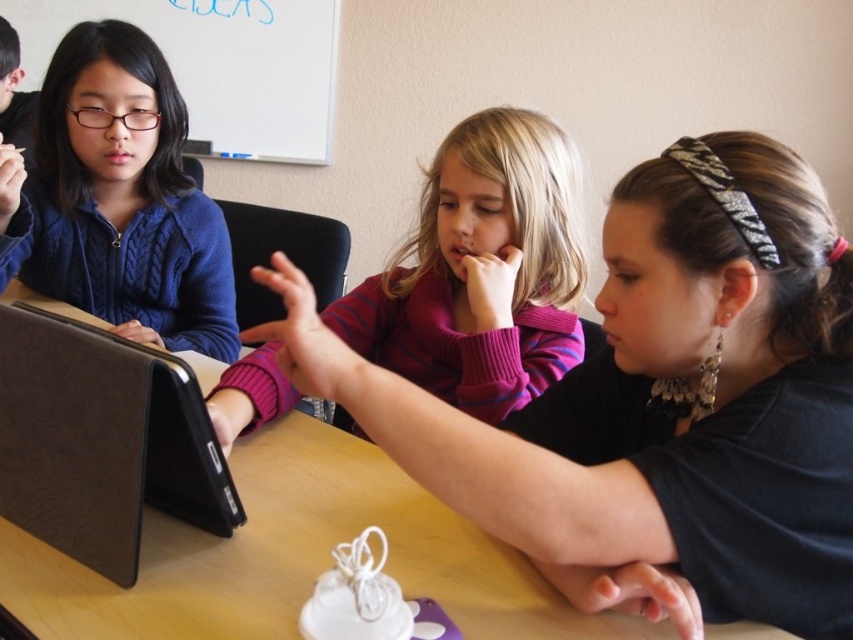
Is cable-knit sweater at upper left to the left of black leather laptop at left from the viewer's perspective?

Yes, cable-knit sweater at upper left is to the left of black leather laptop at left.

Who is more distant from viewer, (77, 269) or (184, 506)?

The point (77, 269) is behind.

Between point (143, 276) and point (67, 348), which one is positioned in front?

Point (67, 348) is more forward.

You are a GUI agent. You are given a task and a screenshot of the screen. Output one action in this format:
    pyautogui.click(x=<x>, y=<y>)
    Task: Click on the cable-knit sweater at upper left
    
    Given the screenshot: What is the action you would take?
    pyautogui.click(x=120, y=198)

Which of these two, black matte shirt at center or cable-knit sweater at upper left, stands taller?

cable-knit sweater at upper left is taller.

Is point (619, 182) farther from viewer compared to point (142, 196)?

No, (619, 182) is closer to viewer.

Which is behind, point (845, 621) or point (178, 348)?

Point (178, 348)

At what (x,y) coordinates should I click in order to perform the action: click on black matte shirt at center. Please return your answer as a coordinate pair (x, y). The height and width of the screenshot is (640, 853). Looking at the image, I should click on (659, 401).

Is point (758, 186) less distant than point (126, 394)?

No, it is behind (126, 394).

Between black matte shirt at center and black leather laptop at left, which one is positioned higher?

black matte shirt at center is higher up.

Which is behind, point (618, 273) or point (42, 502)?

Point (42, 502)

You are a GUI agent. You are given a task and a screenshot of the screen. Output one action in this format:
    pyautogui.click(x=<x>, y=<y>)
    Task: Click on the black matte shirt at center
    This screenshot has width=853, height=640.
    Given the screenshot: What is the action you would take?
    pyautogui.click(x=659, y=401)